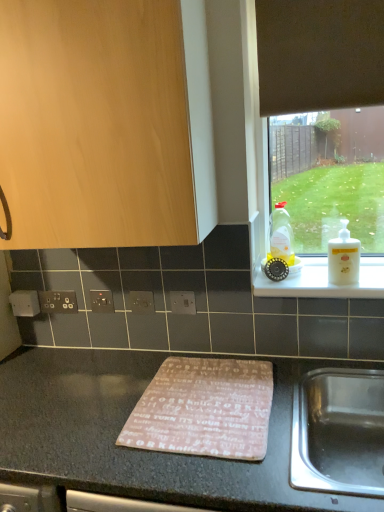
Question: From the image's perspective, is black plastic electrical outlet at lower left, marked as the 1th electric outlet in a left-to-right arrangement, above white glossy lotion at right, acting as the 2th bottle starting from the left?

Choices:
 (A) yes
 (B) no

Answer: (B)

Question: Could white glossy lotion at right, placed as the 1th bottle when sorted from front to back, be considered to be inside black plastic electrical outlet at lower left, marked as the 1th electric outlet in a left-to-right arrangement?

Choices:
 (A) no
 (B) yes

Answer: (A)

Question: Is black plastic electrical outlet at lower left, the fourth electric outlet in the right-to-left sequence, to the right of white glossy lotion at right, acting as the 2th bottle starting from the left, from the viewer's perspective?

Choices:
 (A) no
 (B) yes

Answer: (A)

Question: Considering the relative positions of black plastic electrical outlet at lower left, the fourth electric outlet in the right-to-left sequence, and white glossy lotion at right, acting as the second bottle starting from the back, in the image provided, is black plastic electrical outlet at lower left, the fourth electric outlet in the right-to-left sequence, to the left of white glossy lotion at right, acting as the second bottle starting from the back, from the viewer's perspective?

Choices:
 (A) yes
 (B) no

Answer: (A)

Question: Can you confirm if black plastic electrical outlet at lower left, marked as the 1th electric outlet in a left-to-right arrangement, is bigger than white glossy lotion at right, marked as the 1th bottle in a right-to-left arrangement?

Choices:
 (A) no
 (B) yes

Answer: (A)

Question: Does black plastic electrical outlet at lower left, marked as the 1th electric outlet in a left-to-right arrangement, have a lesser height compared to white glossy lotion at right, acting as the 2th bottle starting from the left?

Choices:
 (A) no
 (B) yes

Answer: (B)

Question: Is pink fabric mat at center located outside white plastic ledge at upper right?

Choices:
 (A) yes
 (B) no

Answer: (A)

Question: Is white plastic ledge at upper right completely or partially inside pink fabric mat at center?

Choices:
 (A) no
 (B) yes

Answer: (A)

Question: Is pink fabric mat at center shorter than white plastic ledge at upper right?

Choices:
 (A) yes
 (B) no

Answer: (A)

Question: Does pink fabric mat at center have a greater width compared to white plastic ledge at upper right?

Choices:
 (A) yes
 (B) no

Answer: (A)

Question: Considering the relative positions of pink fabric mat at center and white plastic ledge at upper right in the image provided, is pink fabric mat at center to the right of white plastic ledge at upper right from the viewer's perspective?

Choices:
 (A) no
 (B) yes

Answer: (A)

Question: Is pink fabric mat at center positioned behind white plastic ledge at upper right?

Choices:
 (A) yes
 (B) no

Answer: (B)

Question: From a real-world perspective, does black plastic electric outlet at center, positioned as the third electric outlet in right-to-left order, stand above black plastic electrical outlet at lower left, the fourth electric outlet in the right-to-left sequence?

Choices:
 (A) yes
 (B) no

Answer: (A)